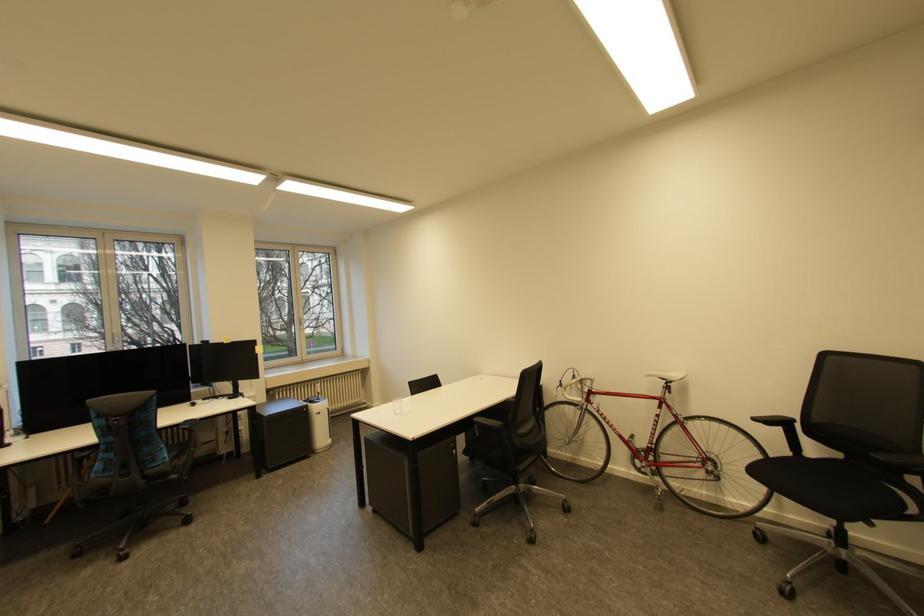
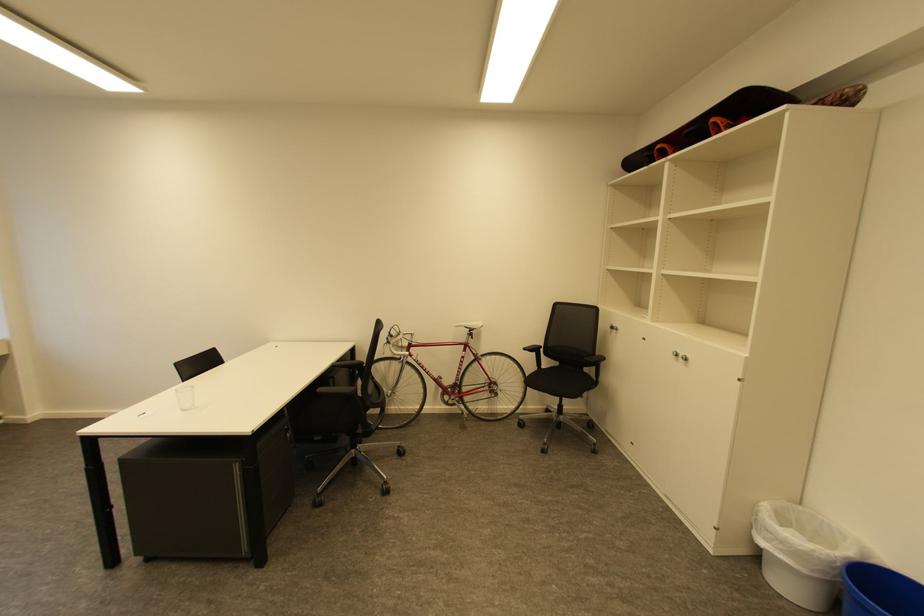
The point at [416,397] is marked in the first image. Where is the corresponding point in the second image?

(185, 384)